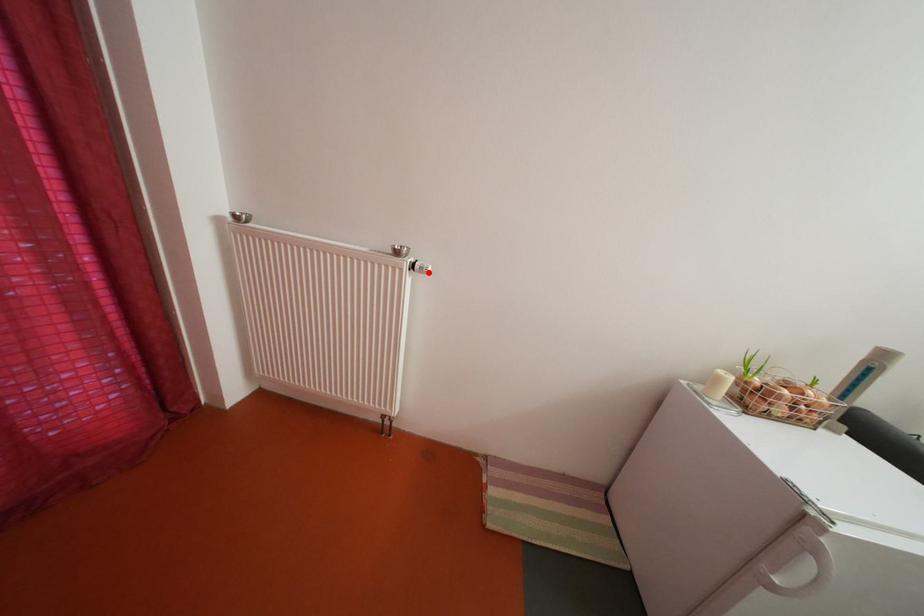
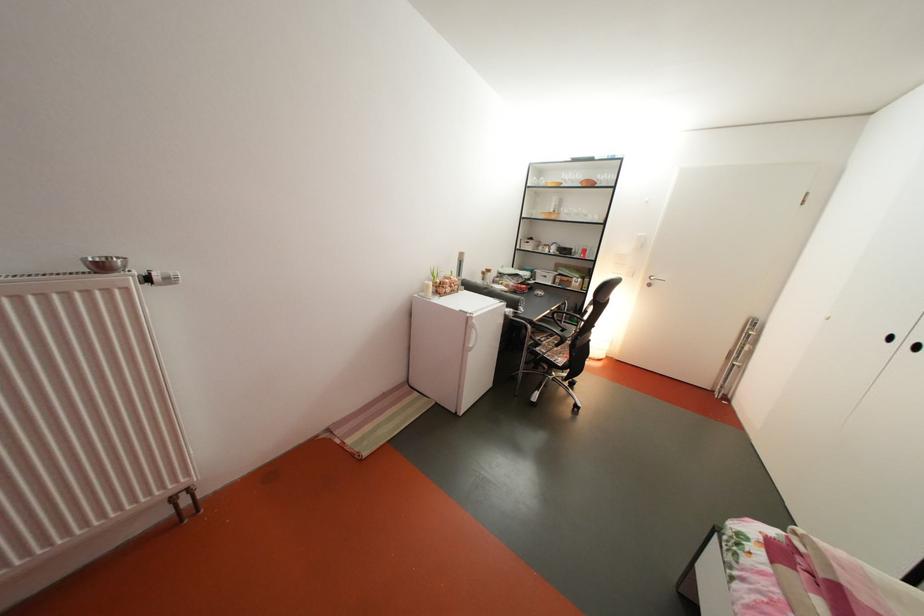
Find the pixel in the second image that matches the highlighted location in the first image.

(168, 285)